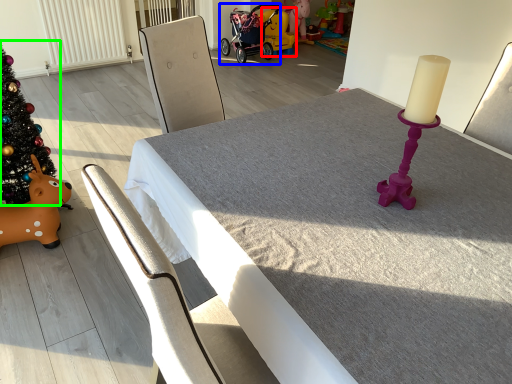
Question: Considering the real-world distances, which object is farthest from toy (highlighted by a red box)? baby carriage (highlighted by a blue box) or christmas tree (highlighted by a green box)?

Choices:
 (A) baby carriage
 (B) christmas tree

Answer: (B)